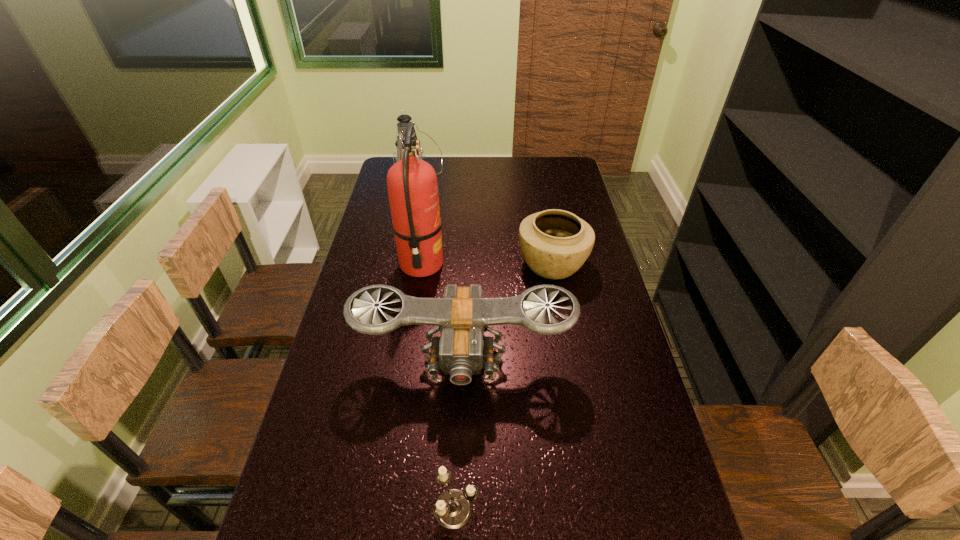
Locate an element on the screen. This screenshot has height=540, width=960. object that stands as the third closest to the pottery is located at coordinates (404, 119).

Image resolution: width=960 pixels, height=540 pixels. I want to click on object that is the fourth closest one to the tallest object, so (x=453, y=509).

You are a GUI agent. You are given a task and a screenshot of the screen. Output one action in this format:
    pyautogui.click(x=<x>, y=<y>)
    Task: Click on the vacant space that satisfies the following two spatial constraints: 1. on the front side of the candle holder; 2. on the left side of the farthest object
    Image resolution: width=960 pixels, height=540 pixels.
    Given the screenshot: What is the action you would take?
    [355, 509]

This screenshot has width=960, height=540. Identify the location of free space that satisfies the following two spatial constraints: 1. on the back side of the pottery; 2. on the right side of the shortest object. pyautogui.click(x=466, y=264).